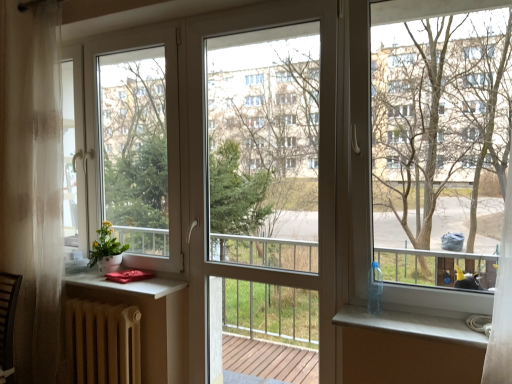
Question: Should I look upward or downward to see matte white pot at left?

Choices:
 (A) down
 (B) up

Answer: (A)

Question: Is bare wood tree at right touching white glossy window sill at lower right?

Choices:
 (A) no
 (B) yes

Answer: (A)

Question: From the image's perspective, is bare wood tree at right under white glossy window sill at lower right?

Choices:
 (A) yes
 (B) no

Answer: (B)

Question: Is bare wood tree at right surrounding white glossy window sill at lower right?

Choices:
 (A) yes
 (B) no

Answer: (A)

Question: From the image's perspective, is bare wood tree at right on white glossy window sill at lower right?

Choices:
 (A) no
 (B) yes

Answer: (B)

Question: From a real-world perspective, is bare wood tree at right under white glossy window sill at lower right?

Choices:
 (A) yes
 (B) no

Answer: (B)

Question: Can you confirm if bare wood tree at right is wider than white glossy window sill at lower right?

Choices:
 (A) yes
 (B) no

Answer: (B)

Question: Is matte white pot at left wider than white glossy window sill at lower right?

Choices:
 (A) no
 (B) yes

Answer: (A)

Question: Can you confirm if matte white pot at left is positioned to the right of white glossy window sill at lower right?

Choices:
 (A) yes
 (B) no

Answer: (B)

Question: Is matte white pot at left placed right next to white glossy window sill at lower right?

Choices:
 (A) no
 (B) yes

Answer: (A)

Question: Is matte white pot at left positioned far away from white glossy window sill at lower right?

Choices:
 (A) no
 (B) yes

Answer: (B)

Question: From a real-world perspective, does matte white pot at left sit lower than white glossy window sill at lower right?

Choices:
 (A) no
 (B) yes

Answer: (A)

Question: Does matte white pot at left contain white glossy window sill at lower right?

Choices:
 (A) yes
 (B) no

Answer: (B)

Question: Is bare wood tree at right shorter than matte brown radiator at lower left?

Choices:
 (A) yes
 (B) no

Answer: (B)